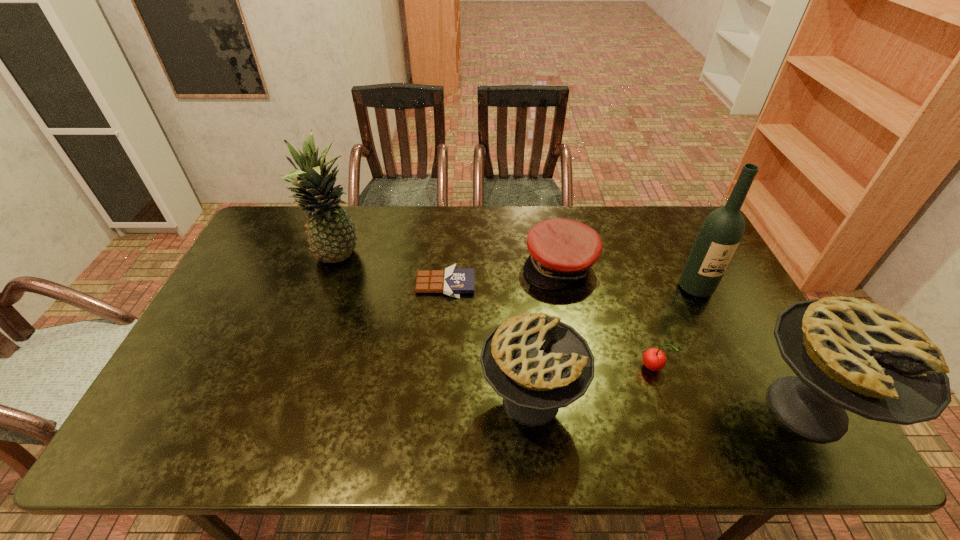
Locate an element on the screen. Image resolution: width=960 pixels, height=540 pixels. object at the near right corner is located at coordinates (848, 353).

Where is `vacant region at the far edge of the desktop`? Image resolution: width=960 pixels, height=540 pixels. vacant region at the far edge of the desktop is located at coordinates (505, 213).

Locate an element on the screen. vacant space at the near edge is located at coordinates (250, 408).

Identify the location of vacant area at the left edge. (256, 289).

Identify the location of vacant space at the right edge of the desktop. The width and height of the screenshot is (960, 540). (728, 273).

Find the location of `free space at the far left corner`. free space at the far left corner is located at coordinates (283, 220).

Identify the location of free location at the far right corner. tap(655, 224).

This screenshot has height=540, width=960. Identify the location of blank region between the leftmost object and the cap. click(x=449, y=262).

The width and height of the screenshot is (960, 540). I want to click on vacant space in between the cap and the cherry, so click(x=606, y=316).

At what (x,y) coordinates should I click in order to perform the action: click on vacant area between the pineapple and the third object from right to left. Please return your answer as a coordinate pair (x, y). This screenshot has width=960, height=540. Looking at the image, I should click on (495, 313).